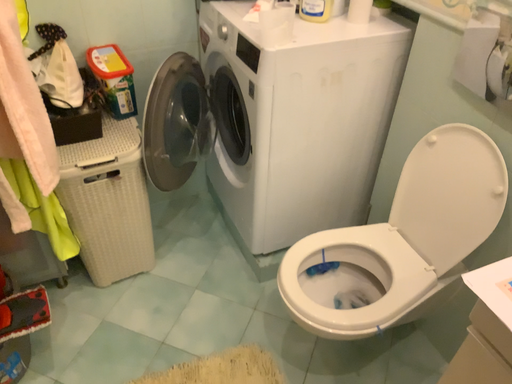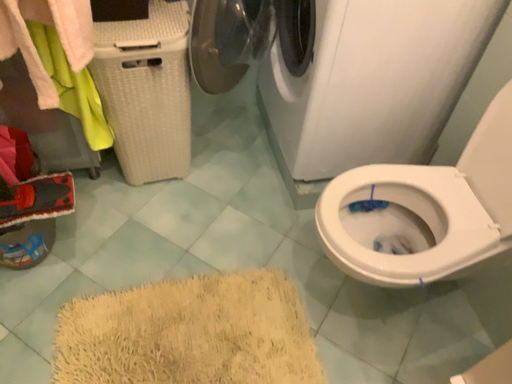
Question: Which way did the camera rotate in the video?

Choices:
 (A) rotated left
 (B) rotated right

Answer: (A)